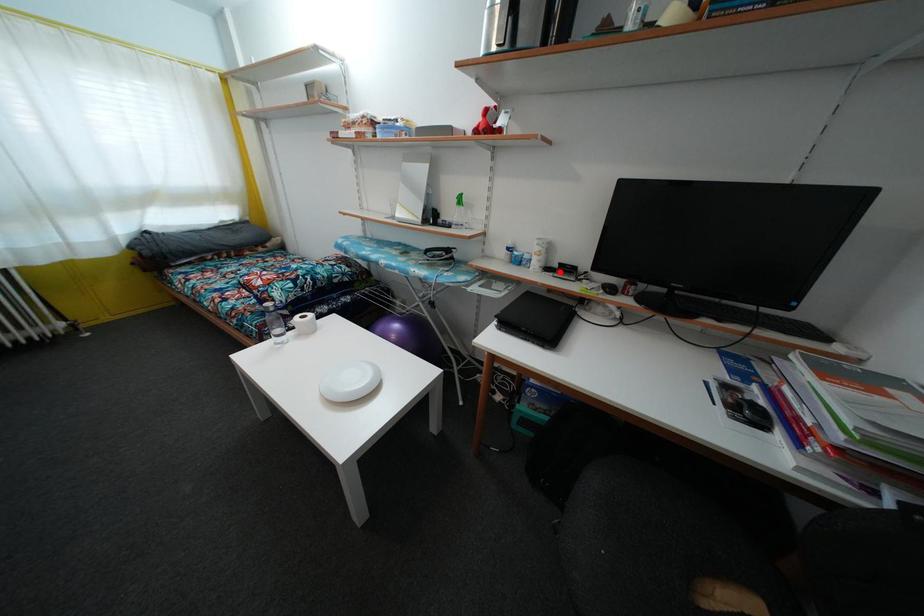
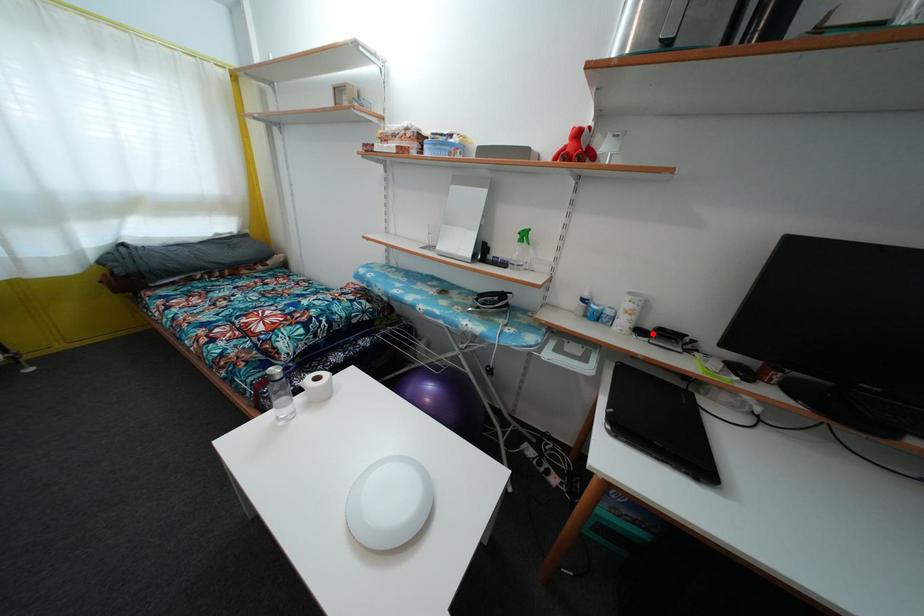
I am providing you with two images of the same scene from different viewpoints. A red point is marked on the first image and another point is marked on the second image. Does the point marked in image1 correspond to the same location as the one in image2?

Yes